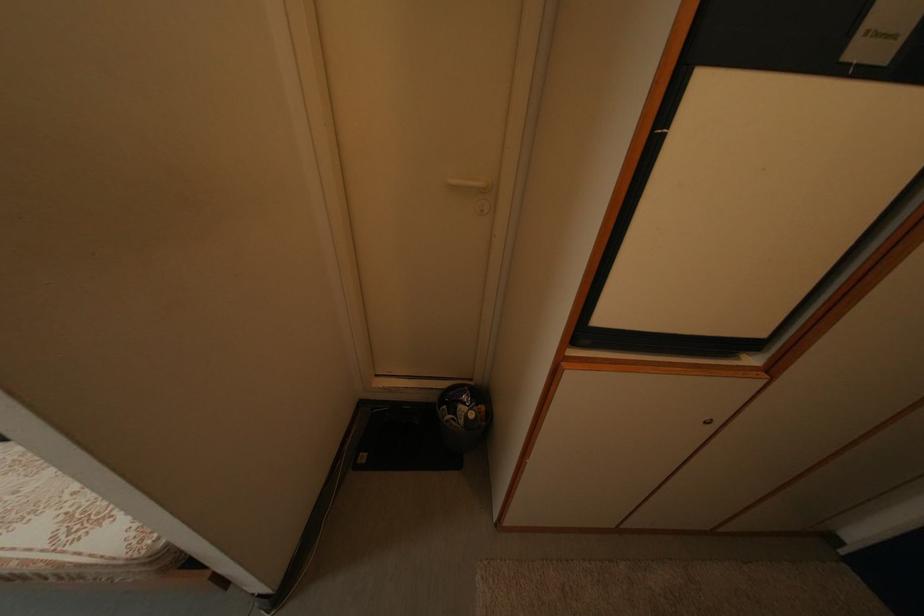
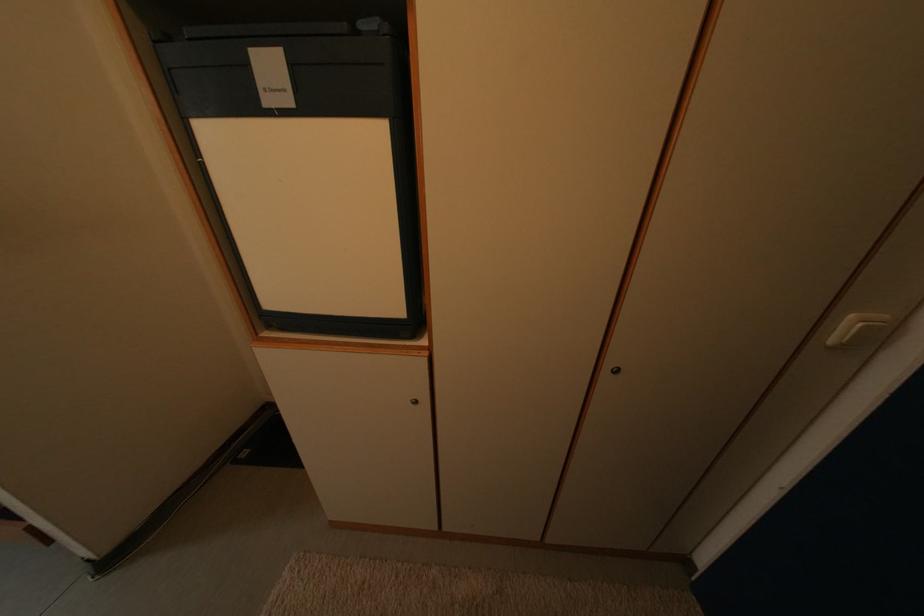
Question: The first image is from the beginning of the video and the second image is from the end. How did the camera likely rotate when shooting the video?

Choices:
 (A) Left
 (B) Right
 (C) Up
 (D) Down

Answer: (C)